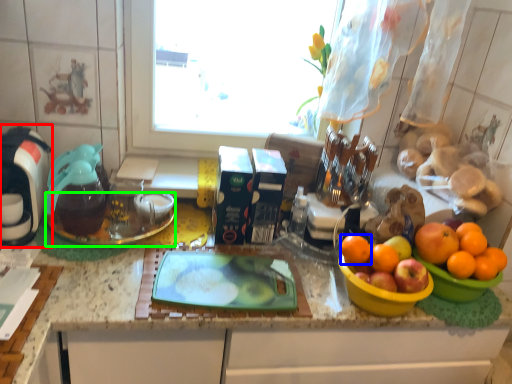
Question: Which object is the closest to the coffee machine (highlighted by a red box)? Choose among these: orange (highlighted by a blue box) or glass plate (highlighted by a green box).

Choices:
 (A) orange
 (B) glass plate

Answer: (B)